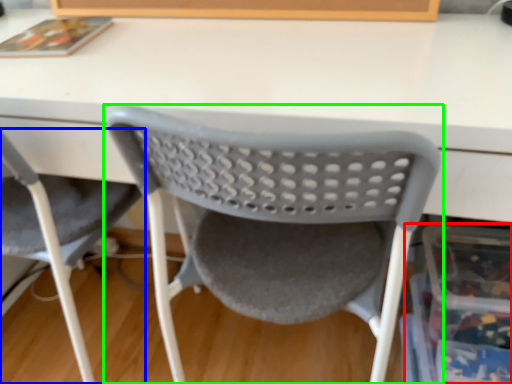
Question: Which is nearer to the storage box (highlighted by a red box)? chair (highlighted by a blue box) or chair (highlighted by a green box).

Choices:
 (A) chair
 (B) chair

Answer: (B)